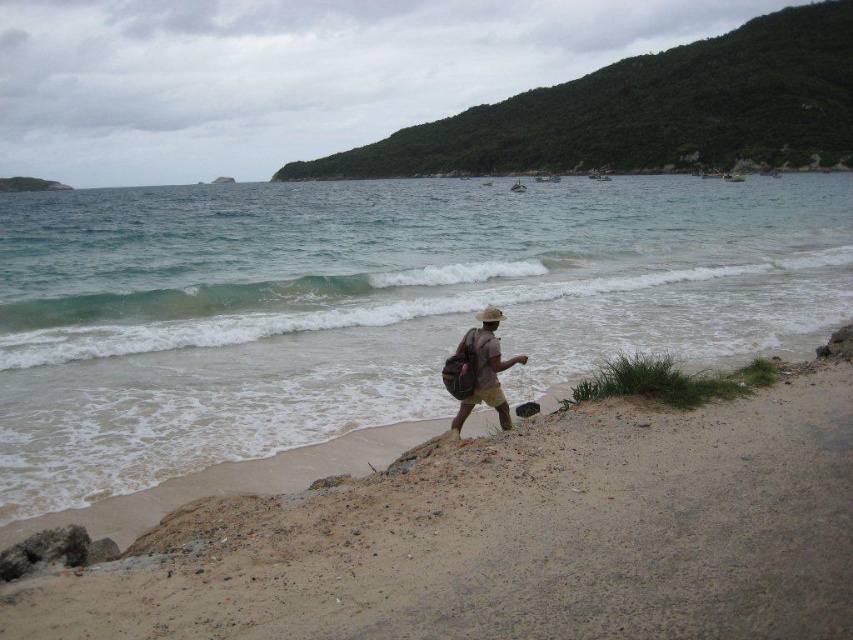
Question: Which point is farther to the camera?

Choices:
 (A) clear blue water at center
 (B) brown canvas backpack at center

Answer: (B)

Question: Can you confirm if clear blue water at center is positioned to the right of brown canvas backpack at center?

Choices:
 (A) no
 (B) yes

Answer: (A)

Question: Which point is farther to the camera?

Choices:
 (A) brown canvas backpack at center
 (B) clear blue water at center

Answer: (A)

Question: Is the position of clear blue water at center more distant than that of brown sandy beach at lower center?

Choices:
 (A) no
 (B) yes

Answer: (B)

Question: Is clear blue water at center closer to the viewer compared to brown sandy beach at lower center?

Choices:
 (A) yes
 (B) no

Answer: (B)

Question: Which object appears closest to the camera in this image?

Choices:
 (A) brown canvas backpack at center
 (B) clear blue water at center

Answer: (B)